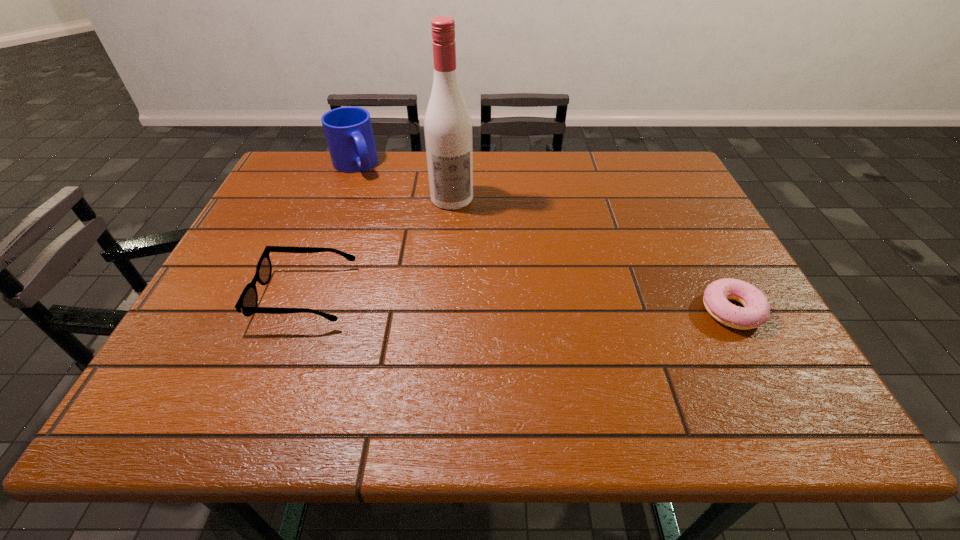
Identify the location of free location located 0.190m on the back of the shortest object. The image size is (960, 540). (690, 233).

Locate an element on the screen. free spot located on the label of the second object from right to left is located at coordinates (463, 256).

Identify the location of free space located on the label of the second object from right to left. The width and height of the screenshot is (960, 540). (473, 308).

Where is `vacant region located on the label of the second object from right to left`? Image resolution: width=960 pixels, height=540 pixels. vacant region located on the label of the second object from right to left is located at coordinates tap(466, 268).

You are a GUI agent. You are given a task and a screenshot of the screen. Output one action in this format:
    pyautogui.click(x=<x>, y=<y>)
    Task: Click on the vacant region located 0.110m on the side with the handle of the farthest object
    Image resolution: width=960 pixels, height=540 pixels.
    Given the screenshot: What is the action you would take?
    pyautogui.click(x=375, y=198)

At what (x,y) coordinates should I click in order to perform the action: click on free point located on the side with the handle of the farthest object. Please return your answer as a coordinate pair (x, y). The image size is (960, 540). Looking at the image, I should click on (414, 251).

I want to click on blank area located 0.280m on the side with the handle of the farthest object, so click(x=400, y=232).

I want to click on alcohol that is at the far edge, so click(448, 134).

Locate an element on the screen. mug that is at the far edge is located at coordinates (348, 130).

Where is `spectacles that is positioned at the left edge`? The height and width of the screenshot is (540, 960). spectacles that is positioned at the left edge is located at coordinates (247, 303).